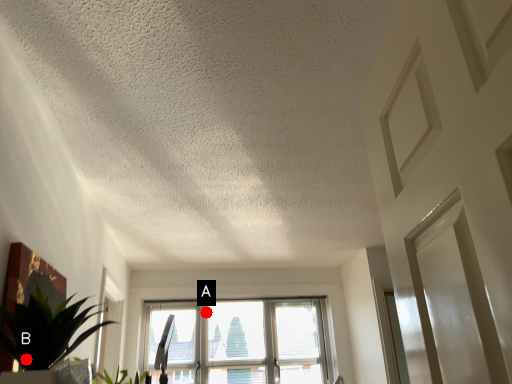
Question: Two points are circled on the image, labeled by A and B beside each circle. Which of the following is the closest to the observer?

Choices:
 (A) A is closer
 (B) B is closer

Answer: (B)